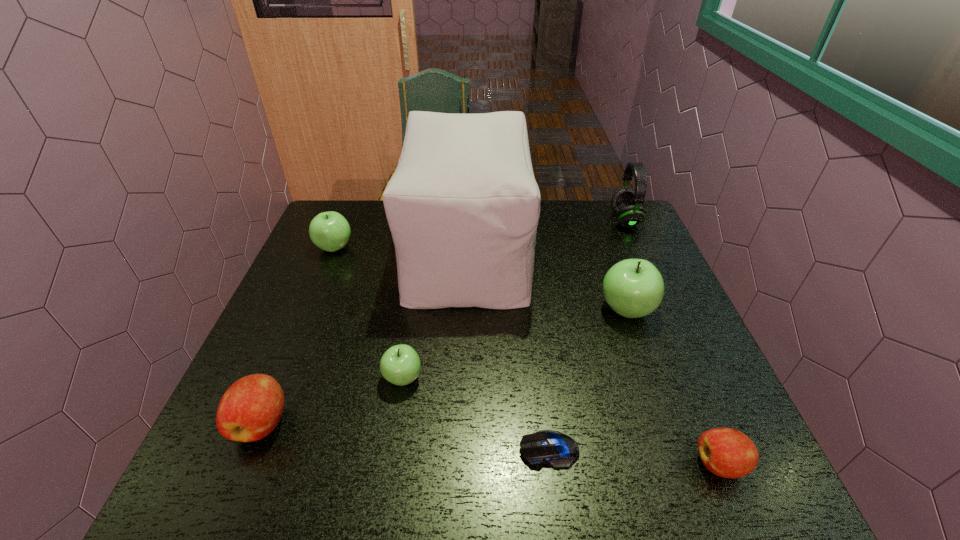
Locate an element on the screen. Image resolution: width=960 pixels, height=540 pixels. the fifth farthest object is located at coordinates (400, 365).

This screenshot has width=960, height=540. I want to click on the smaller red apple, so click(x=729, y=453).

Locate an element on the screen. This screenshot has height=540, width=960. the shortest object is located at coordinates (557, 450).

Locate an element on the screen. The width and height of the screenshot is (960, 540). free space located on the side of the tallest object with the smiley face is located at coordinates (551, 251).

At what (x,y) coordinates should I click in order to perform the action: click on vacant position located 0.320m on the ear cups of the black headset. Please return your answer as a coordinate pair (x, y). Looking at the image, I should click on (512, 220).

This screenshot has height=540, width=960. Find the location of `free space located 0.270m on the ear cups of the black headset`. free space located 0.270m on the ear cups of the black headset is located at coordinates coord(528,220).

The width and height of the screenshot is (960, 540). Find the location of `vacant space located 0.100m on the ear cups of the black headset`. vacant space located 0.100m on the ear cups of the black headset is located at coordinates (580, 220).

The height and width of the screenshot is (540, 960). Find the location of `free region located 0.070m on the left of the second farthest apple`. free region located 0.070m on the left of the second farthest apple is located at coordinates (571, 310).

Where is `vacant space located 0.120m on the back of the leftmost green apple`? Image resolution: width=960 pixels, height=540 pixels. vacant space located 0.120m on the back of the leftmost green apple is located at coordinates (348, 215).

This screenshot has width=960, height=540. Identify the location of vacant space located on the back of the bigger red apple. (307, 312).